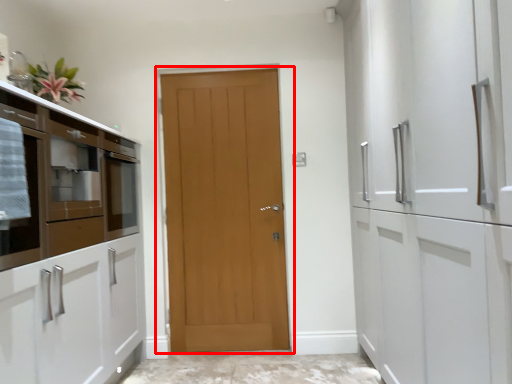
Question: From the image's perspective, where is door (annotated by the red box) located in relation to cabinetry in the image?

Choices:
 (A) above
 (B) below

Answer: (B)